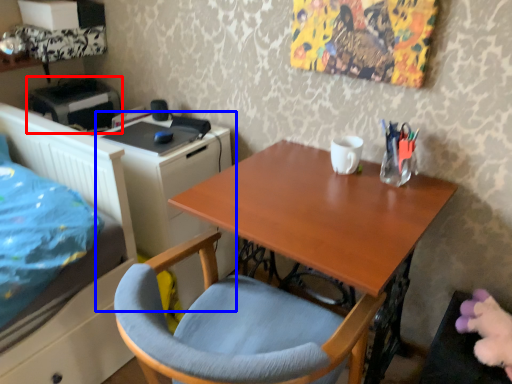
Question: Which object appears closest to the camera in this image, printer (highlighted by a red box) or file cabinet (highlighted by a blue box)?

Choices:
 (A) printer
 (B) file cabinet

Answer: (B)